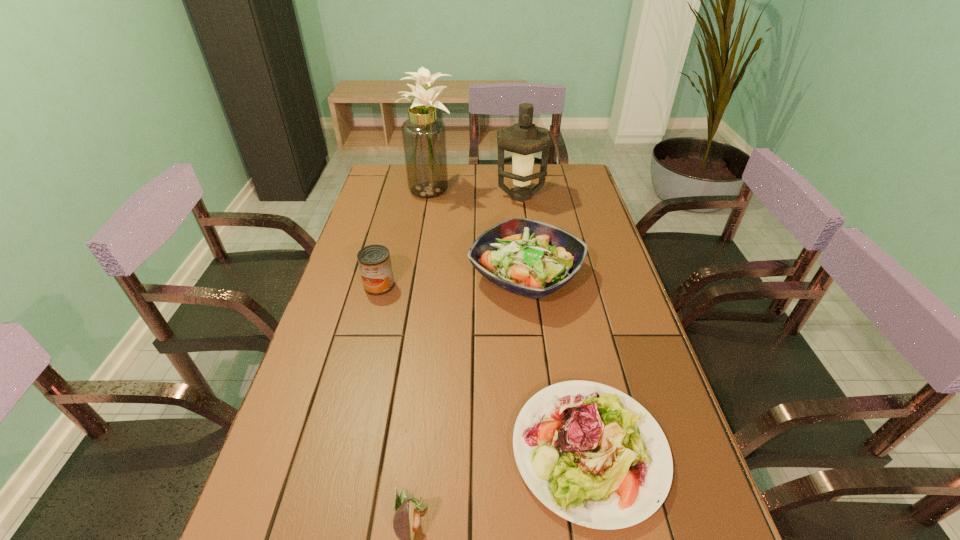
You are a GUI agent. You are given a task and a screenshot of the screen. Output one action in this format:
    pyautogui.click(x=<x>, y=<y>)
    Task: Click on the flower arrangement
    This screenshot has width=960, height=540.
    Given the screenshot: What is the action you would take?
    pyautogui.click(x=424, y=137)

Find the location of a particular element. the fifth shortest object is located at coordinates (523, 139).

Where is `the taller salad plate`? the taller salad plate is located at coordinates (527, 257).

Identify the location of can. Image resolution: width=960 pixels, height=540 pixels. (374, 261).

The width and height of the screenshot is (960, 540). What are the coordinates of `the shorter salad plate` in the screenshot? It's located at (612, 468).

The image size is (960, 540). I want to click on the shortest object, so click(x=612, y=468).

At what (x,y) coordinates should I click in order to perform the action: click on vacant area situated 0.230m on the front of the tallest object. Please return your answer as a coordinate pair (x, y). Looking at the image, I should click on click(420, 244).

Identify the location of vacant space situated on the left of the oil lamp. (456, 196).

Where is `free space located on the left of the taller salad plate`? Image resolution: width=960 pixels, height=540 pixels. free space located on the left of the taller salad plate is located at coordinates (415, 275).

The width and height of the screenshot is (960, 540). What are the coordinates of `free point located 0.240m on the back of the can` in the screenshot? It's located at (394, 230).